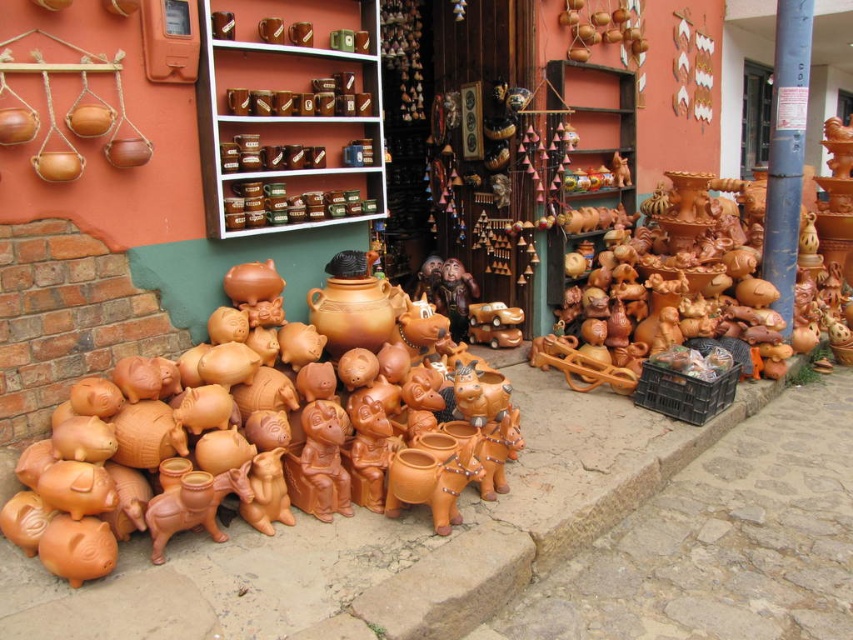
Locate an element on the screen. The width and height of the screenshot is (853, 640). matte ceramic mugs at upper center is located at coordinates (289, 115).

Can you confirm if matte ceramic mugs at upper center is thinner than blue painted wood pole at upper right?

No.

Does point (260, 141) come in front of point (782, 4)?

Yes, it is.

Locate an element on the screen. The image size is (853, 640). matte ceramic mugs at upper center is located at coordinates (289, 115).

Is terracotta clay piggy banks at center closer to the viewer compared to blue painted wood pole at upper right?

That is True.

At what (x,y) coordinates should I click in order to perform the action: click on terracotta clay piggy banks at center. Please return your answer as a coordinate pair (x, y). The height and width of the screenshot is (640, 853). Looking at the image, I should click on (218, 442).

Between terracotta clay piggy banks at center and matte brown boxes at upper center, which one is positioned higher?

matte brown boxes at upper center

Which is behind, point (181, 364) or point (241, 108)?

The point (241, 108) is more distant.

Locate an element on the screen. The image size is (853, 640). terracotta clay piggy banks at center is located at coordinates (218, 442).